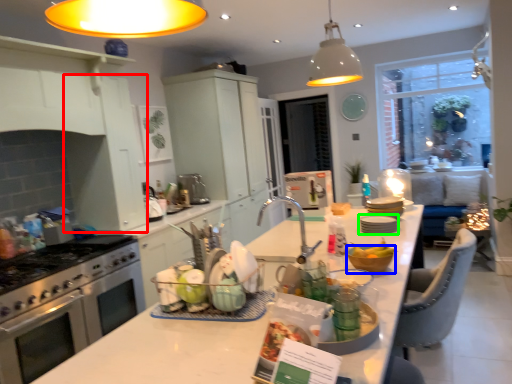
Question: Estimate the real-world distances between objects in this image. Which object is farther from cabinetry (highlighted by a red box), mixing bowl (highlighted by a blue box) or tableware (highlighted by a green box)?

Choices:
 (A) mixing bowl
 (B) tableware

Answer: (A)